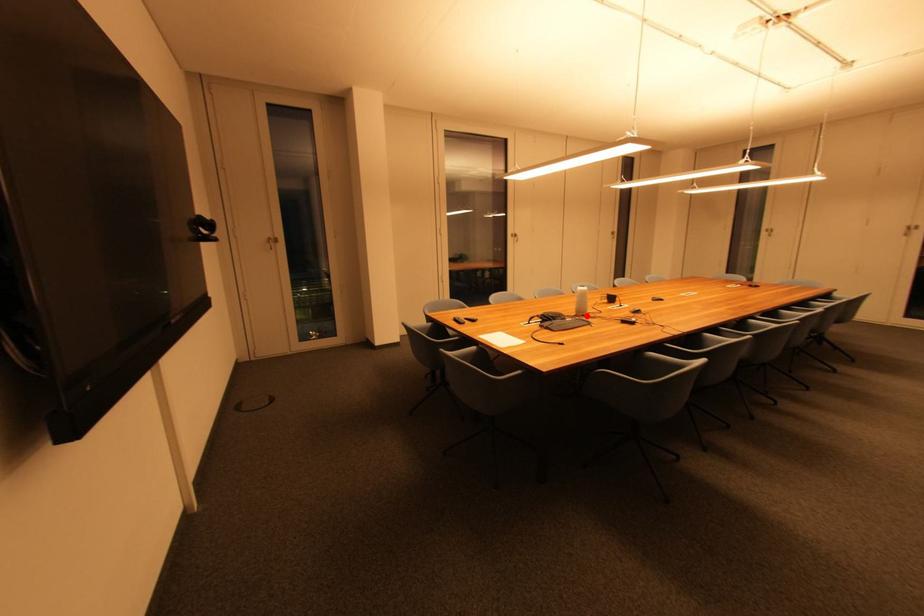
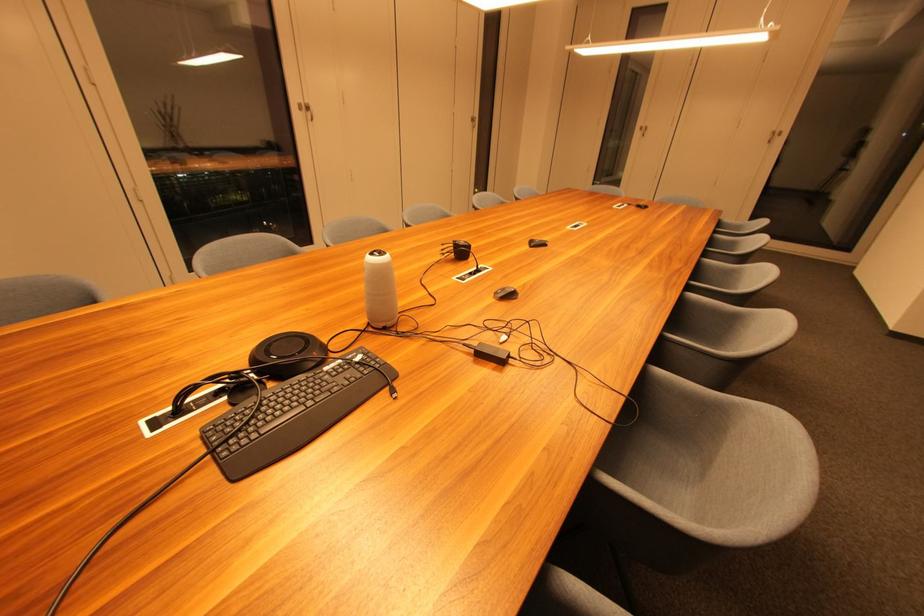
In the second image, find the point that corresponds to the highlighted location in the first image.

(386, 326)